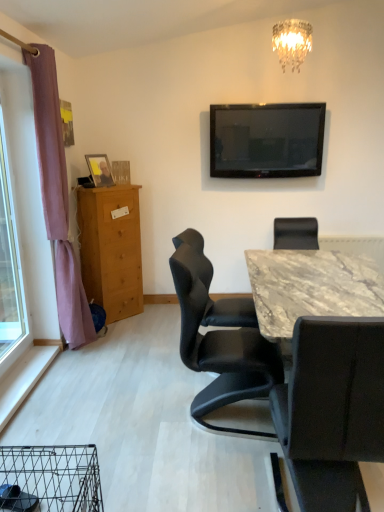
Question: Is flat-screen tv at upper center at the right side of light brown wooden chest of drawers at left?

Choices:
 (A) no
 (B) yes

Answer: (B)

Question: Can you confirm if flat-screen tv at upper center is shorter than light brown wooden chest of drawers at left?

Choices:
 (A) yes
 (B) no

Answer: (A)

Question: Can you confirm if flat-screen tv at upper center is bigger than light brown wooden chest of drawers at left?

Choices:
 (A) no
 (B) yes

Answer: (A)

Question: Is flat-screen tv at upper center located outside light brown wooden chest of drawers at left?

Choices:
 (A) yes
 (B) no

Answer: (A)

Question: Considering the relative positions of flat-screen tv at upper center and light brown wooden chest of drawers at left in the image provided, is flat-screen tv at upper center behind light brown wooden chest of drawers at left?

Choices:
 (A) yes
 (B) no

Answer: (A)

Question: Is flat-screen tv at upper center looking in the opposite direction of light brown wooden chest of drawers at left?

Choices:
 (A) no
 (B) yes

Answer: (A)

Question: From a real-world perspective, is flat-screen tv at upper center beneath wooden photo frame at left?

Choices:
 (A) no
 (B) yes

Answer: (A)

Question: Is flat-screen tv at upper center thinner than wooden photo frame at left?

Choices:
 (A) yes
 (B) no

Answer: (B)

Question: From a real-world perspective, does flat-screen tv at upper center stand above wooden photo frame at left?

Choices:
 (A) yes
 (B) no

Answer: (A)

Question: Would you say flat-screen tv at upper center contains wooden photo frame at left?

Choices:
 (A) yes
 (B) no

Answer: (B)

Question: Is flat-screen tv at upper center positioned in front of wooden photo frame at left?

Choices:
 (A) yes
 (B) no

Answer: (B)

Question: Is flat-screen tv at upper center positioned behind wooden photo frame at left?

Choices:
 (A) yes
 (B) no

Answer: (A)

Question: Considering the relative sizes of black leather chair at center, positioned as the 1th chair in right-to-left order, and black leather chair at center, which is the 1th chair from left to right, in the image provided, is black leather chair at center, positioned as the 1th chair in right-to-left order, smaller than black leather chair at center, which is the 1th chair from left to right,?

Choices:
 (A) no
 (B) yes

Answer: (A)